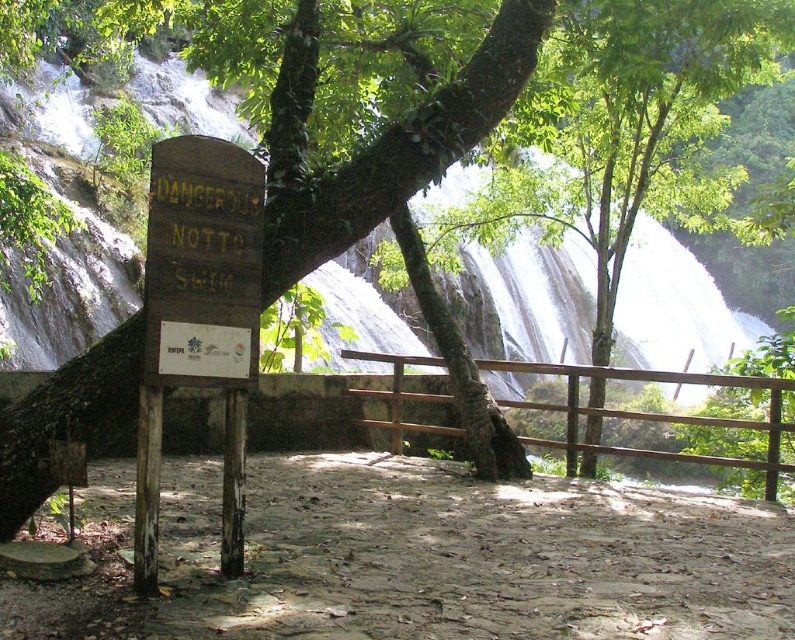
You are standing at the edge of the waterfall and want to walk towards the signpost. Which point, point (474, 259) or point (179, 259), is closer to you as you start walking?

Point (474, 259) is closer to you because it is further to the viewer than point (179, 259).

You are a hiker who just arrived at the waterfall. You see the white frothy water at center and the wooden sign at center. Which object is higher in the image?

The white frothy water at center is positioned over the wooden sign at center, so it is higher.